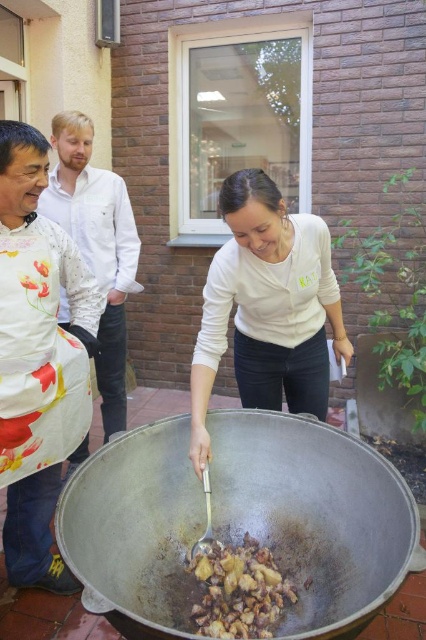
You are a guest at this outdoor cooking event and want to know which item is taller between the floral fabric apron at left and the brown matte meat at center. Can you tell me?

The floral fabric apron at left is taller than the brown matte meat at center.

Based on the photo, you are a guest at this outdoor cooking event and want to take a photo of the brown matte meat at center without blocking the floral fabric apron at left in the shot. Is it possible?

The floral fabric apron at left is further to the viewer than brown matte meat at center. Since the apron is closer to you, you can adjust your position to move around it so that the brown matte meat at center is visible without the apron blocking the view.

You are helping set up for an outdoor cooking event and need to decide where to place the floral fabric apron at left and the brown matte meat at center. Since the apron is larger, where should you place it to avoid overcrowding the workspace?

The floral fabric apron at left is bigger than the brown matte meat at center, so you should place the floral fabric apron at left in a larger area or on a surface that can accommodate its size to prevent overcrowding the workspace.